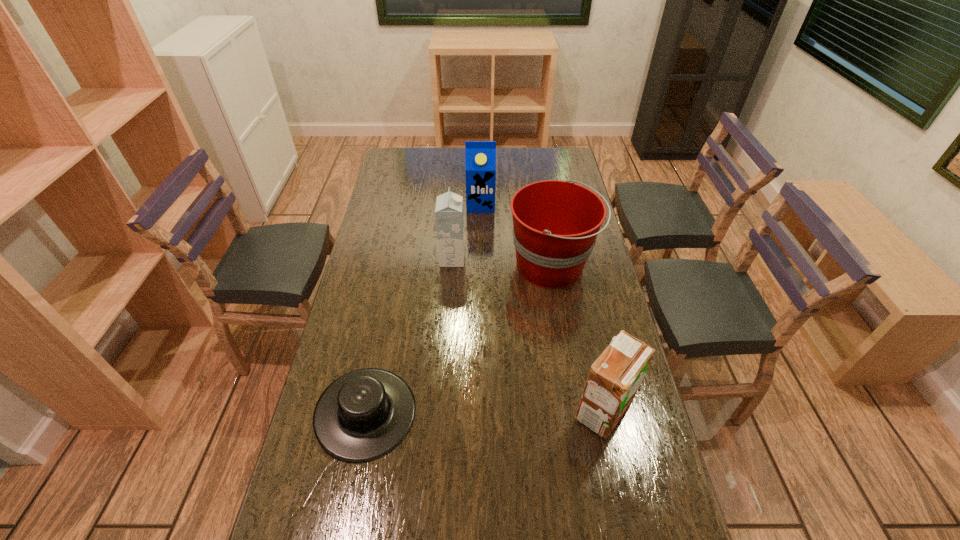
Choose which carton is the nearest neighbor to the bucket. Please provide its 2D coordinates. Your answer should be formatted as a tuple, i.e. [(x, y)], where the tuple contains the x and y coordinates of a point satisfying the conditions above.

[(449, 218)]